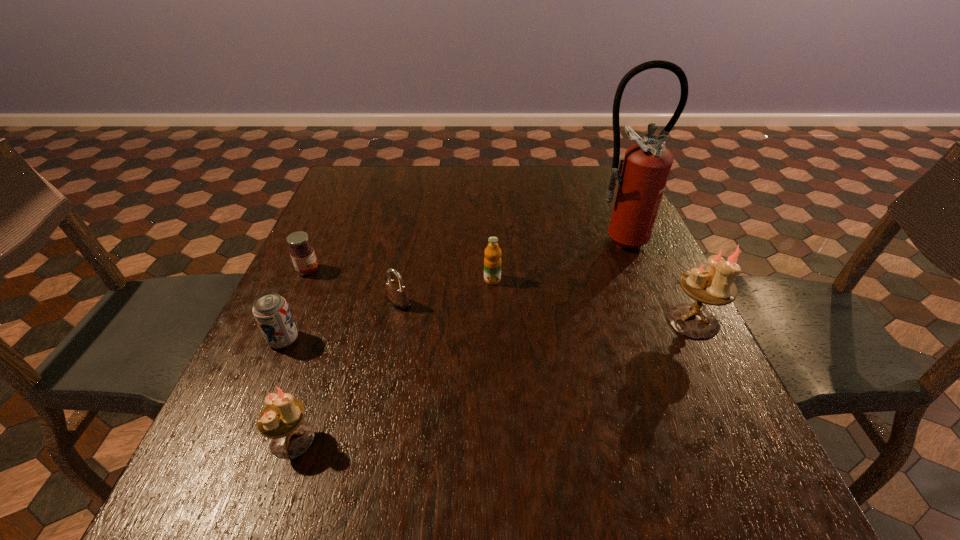
If equal spacing is the goal by inserting an additional candle_holder among them, please point out a vacant space for this new candle_holder. Please provide its 2D coordinates. Your answer should be formatted as a tuple, i.e. [(x, y)], where the tuple contains the x and y coordinates of a point satisfying the conditions above.

[(517, 373)]